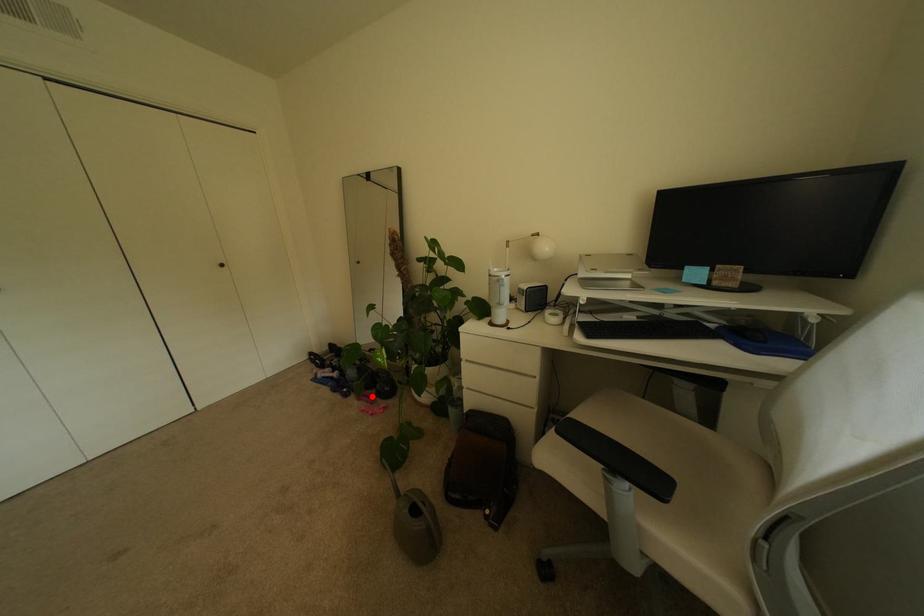
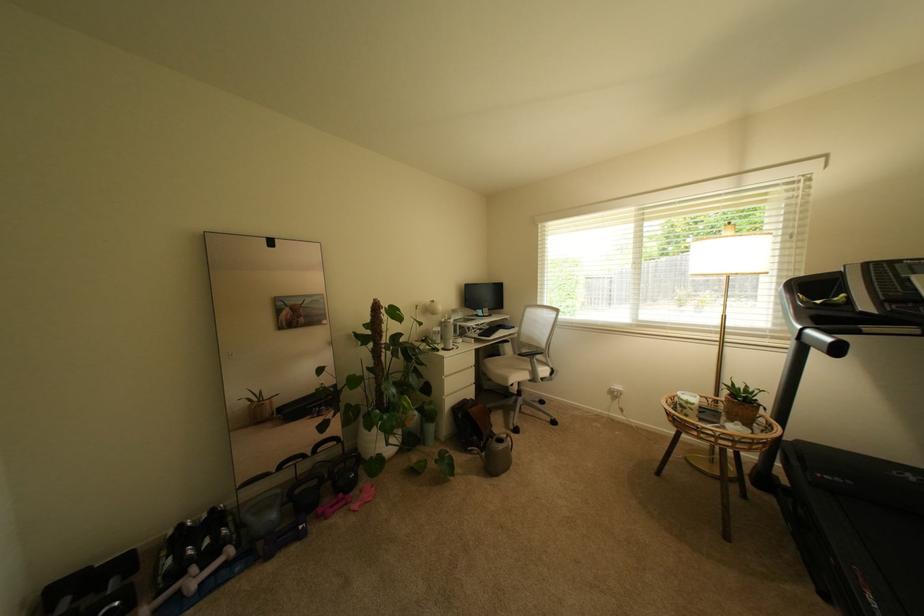
In the second image, find the point that corresponds to the highlighted location in the first image.

(339, 508)